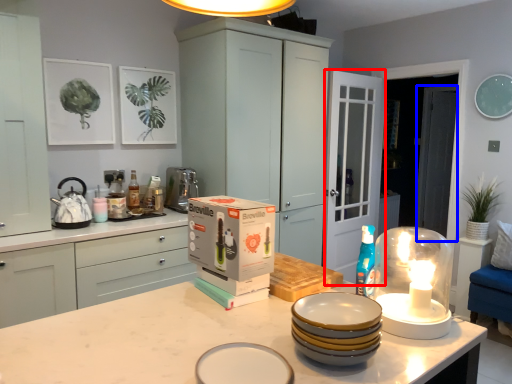
Question: Which point is closer to the camera, glass door (highlighted by a red box) or glass door (highlighted by a blue box)?

Choices:
 (A) glass door
 (B) glass door

Answer: (A)